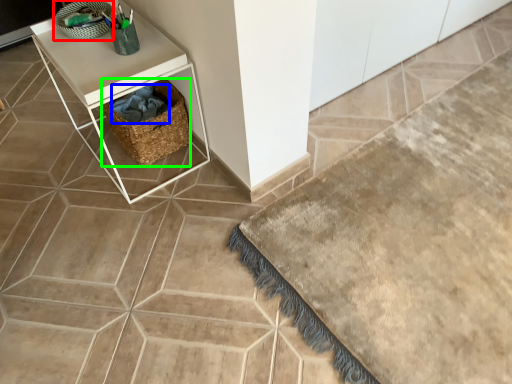
Question: Which object is the farthest from basket (highlighted by a red box)? Choose among these: material (highlighted by a blue box) or basket (highlighted by a green box).

Choices:
 (A) material
 (B) basket

Answer: (B)